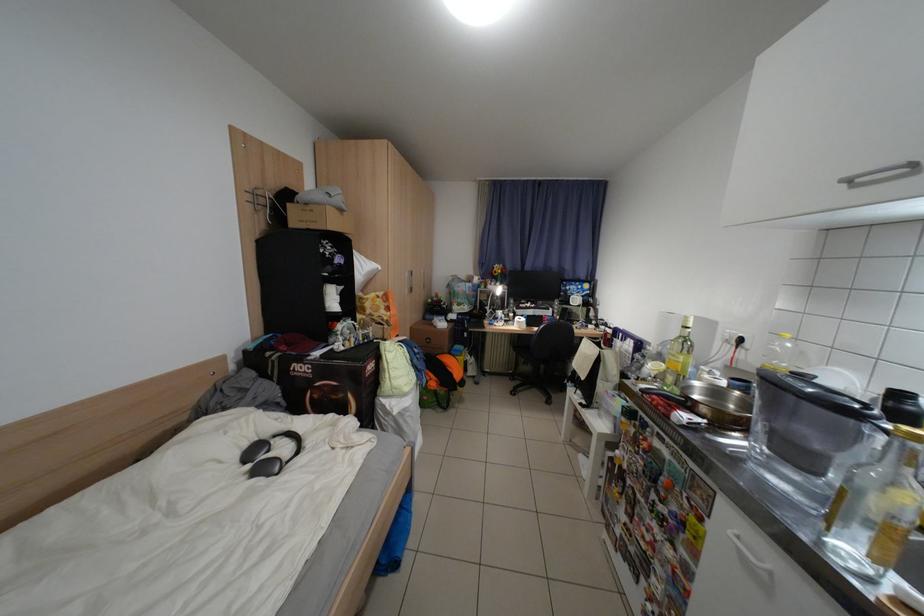
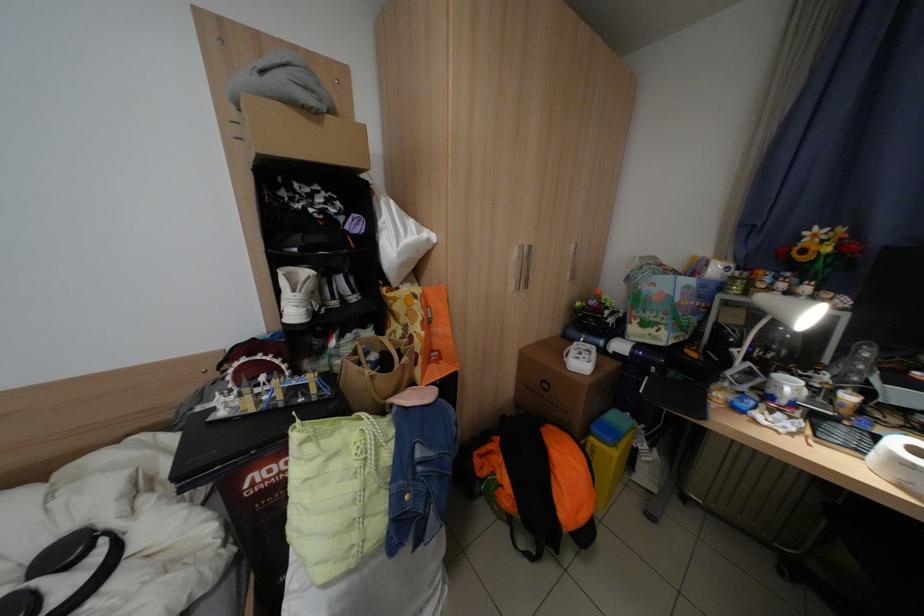
Where in the second image is the point corresponding to the point at 464,376 from the first image?

(565, 508)